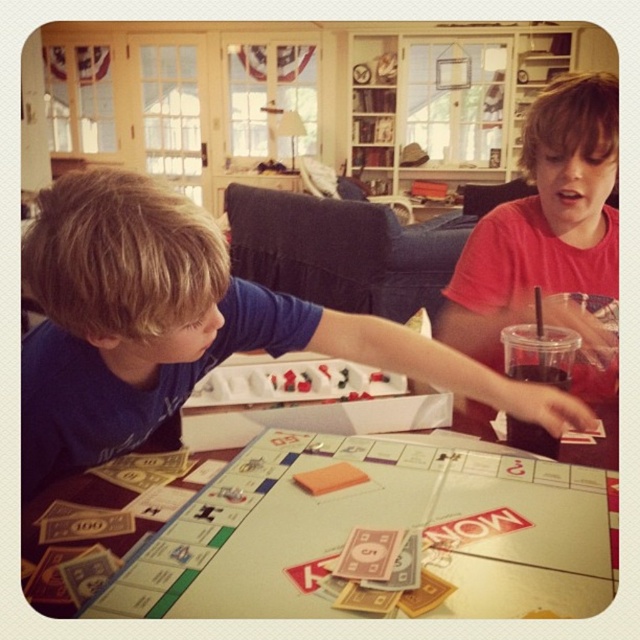
Question: Which of these objects is positioned closest to the blue cotton shirt at center?

Choices:
 (A) translucent plastic cup with straw at lower right
 (B) matte pink shirt at upper right

Answer: (A)

Question: Is white glossy monopoly board at center wider than matte pink shirt at upper right?

Choices:
 (A) no
 (B) yes

Answer: (B)

Question: Which point is closer to the camera taking this photo?

Choices:
 (A) (64, 406)
 (B) (529, 432)
 (C) (586, 188)

Answer: (A)

Question: Which object is farther from the camera taking this photo?

Choices:
 (A) blue cotton shirt at center
 (B) translucent plastic cup with straw at lower right
 (C) matte pink shirt at upper right

Answer: (C)

Question: Can you confirm if white glossy monopoly board at center is positioned below matte pink shirt at upper right?

Choices:
 (A) no
 (B) yes

Answer: (B)

Question: Is matte pink shirt at upper right to the right of translucent plastic cup with straw at lower right from the viewer's perspective?

Choices:
 (A) no
 (B) yes

Answer: (B)